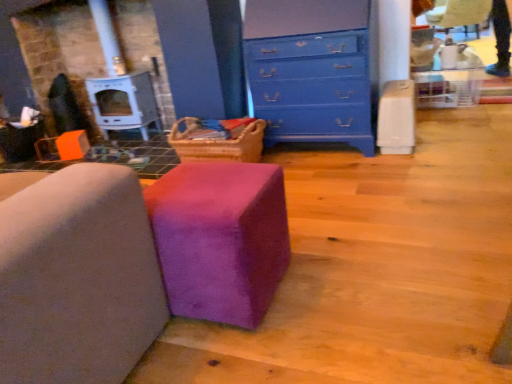
Question: Does purple suede ottoman at center, which is the 2th furniture from right to left, have a greater height compared to blue painted wood chest of drawers at upper center?

Choices:
 (A) no
 (B) yes

Answer: (A)

Question: Is purple suede ottoman at center, which is the 2th furniture from right to left, facing away from blue painted wood chest of drawers at upper center?

Choices:
 (A) no
 (B) yes

Answer: (A)

Question: From a real-world perspective, is purple suede ottoman at center, placed as the 1th furniture when sorted from left to right, under blue painted wood chest of drawers at upper center?

Choices:
 (A) no
 (B) yes

Answer: (B)

Question: From a real-world perspective, does purple suede ottoman at center, placed as the 1th furniture when sorted from left to right, stand above blue painted wood chest of drawers at upper center?

Choices:
 (A) yes
 (B) no

Answer: (B)

Question: Are purple suede ottoman at center, which is the 2th furniture from right to left, and blue painted wood chest of drawers at upper center beside each other?

Choices:
 (A) yes
 (B) no

Answer: (B)

Question: Would you say blue painted wood chest of drawers at upper center is inside or outside purple fuzzy ottoman at center, placed as the first furniture when sorted from right to left?

Choices:
 (A) inside
 (B) outside

Answer: (B)

Question: From the image's perspective, is blue painted wood chest of drawers at upper center located above or below purple fuzzy ottoman at center, placed as the first furniture when sorted from right to left?

Choices:
 (A) above
 (B) below

Answer: (A)

Question: From a real-world perspective, is blue painted wood chest of drawers at upper center above or below purple fuzzy ottoman at center, placed as the first furniture when sorted from right to left?

Choices:
 (A) above
 (B) below

Answer: (A)

Question: Relative to purple fuzzy ottoman at center, marked as the second furniture in a left-to-right arrangement, is blue painted wood chest of drawers at upper center in front or behind?

Choices:
 (A) front
 (B) behind

Answer: (B)

Question: Is blue painted wood chest of drawers at upper center inside the boundaries of purple suede ottoman at center, which is the 2th furniture from right to left, or outside?

Choices:
 (A) outside
 (B) inside

Answer: (A)

Question: Is point (310, 8) closer or farther from the camera than point (122, 251)?

Choices:
 (A) farther
 (B) closer

Answer: (A)

Question: Looking at their shapes, would you say blue painted wood chest of drawers at upper center is wider or thinner than purple suede ottoman at center, which is the 2th furniture from right to left?

Choices:
 (A) thin
 (B) wide

Answer: (A)

Question: Would you say blue painted wood chest of drawers at upper center is to the left or to the right of purple suede ottoman at center, which is the 2th furniture from right to left, in the picture?

Choices:
 (A) right
 (B) left

Answer: (A)

Question: Is point (97, 364) positioned closer to the camera than point (245, 297)?

Choices:
 (A) closer
 (B) farther

Answer: (A)

Question: Is purple suede ottoman at center, placed as the 1th furniture when sorted from left to right, inside or outside of purple fuzzy ottoman at center, marked as the second furniture in a left-to-right arrangement?

Choices:
 (A) outside
 (B) inside

Answer: (A)